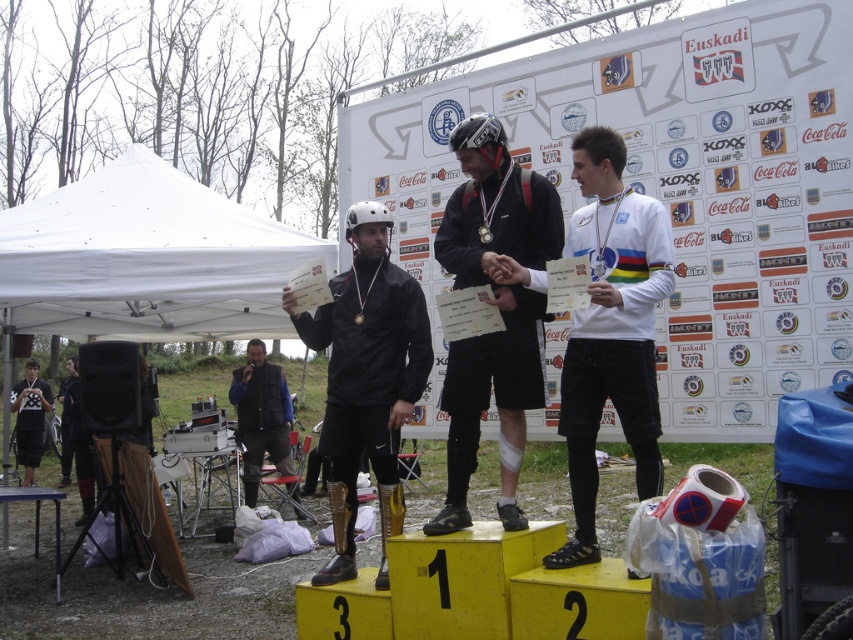
Consider the image. Does white fabric canopy at left have a greater width compared to white jersey at left?

No, white fabric canopy at left is not wider than white jersey at left.

Is white fabric canopy at left to the right of white jersey at left from the viewer's perspective?

Correct, you'll find white fabric canopy at left to the right of white jersey at left.

This screenshot has height=640, width=853. What do you see at coordinates (146, 259) in the screenshot? I see `white fabric canopy at left` at bounding box center [146, 259].

Where is `white fabric canopy at left`? white fabric canopy at left is located at coordinates (146, 259).

Between point (271, 417) and point (38, 404), which one is positioned behind?

Positioned behind is point (38, 404).

Is point (263, 428) closer to camera compared to point (27, 380)?

Yes, it is.

The image size is (853, 640). Describe the element at coordinates (260, 417) in the screenshot. I see `black leather vest at center` at that location.

At what (x,y) coordinates should I click in order to perform the action: click on black leather vest at center. Please return your answer as a coordinate pair (x, y). The height and width of the screenshot is (640, 853). Looking at the image, I should click on (260, 417).

Does white fabric canopy at left appear on the left side of matte black helmet at center?

Indeed, white fabric canopy at left is positioned on the left side of matte black helmet at center.

Which is above, white fabric canopy at left or matte black helmet at center?

Positioned higher is white fabric canopy at left.

This screenshot has height=640, width=853. What do you see at coordinates (146, 259) in the screenshot? I see `white fabric canopy at left` at bounding box center [146, 259].

Image resolution: width=853 pixels, height=640 pixels. I want to click on white fabric canopy at left, so click(146, 259).